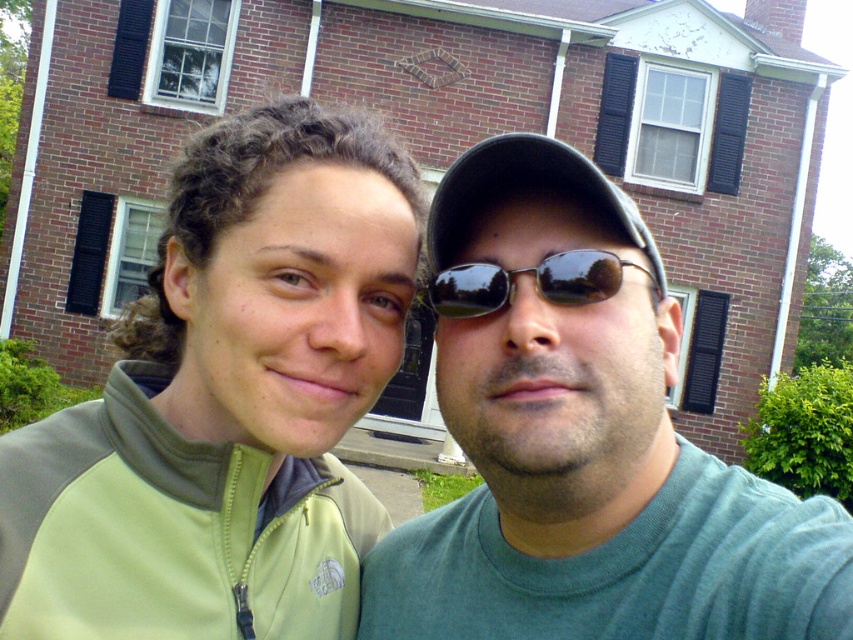
Question: Which object appears farthest from the camera in this image?

Choices:
 (A) black reflective sunglasses at center
 (B) black matte baseball cap at center

Answer: (A)

Question: From the image, what is the correct spatial relationship of green fleece jacket at center in relation to black matte baseball cap at center?

Choices:
 (A) left
 (B) right

Answer: (A)

Question: Does green fleece jacket at center appear on the left side of black matte baseball cap at center?

Choices:
 (A) no
 (B) yes

Answer: (B)

Question: Among these objects, which one is farthest from the camera?

Choices:
 (A) green fleece jacket at center
 (B) black matte baseball cap at center
 (C) black reflective sunglasses at center

Answer: (A)

Question: Based on their relative distances, which object is nearer to the black matte baseball cap at center?

Choices:
 (A) green fleece jacket at center
 (B) green matte shirt at center

Answer: (B)

Question: Can you confirm if green matte shirt at center is positioned below black reflective sunglasses at center?

Choices:
 (A) yes
 (B) no

Answer: (A)